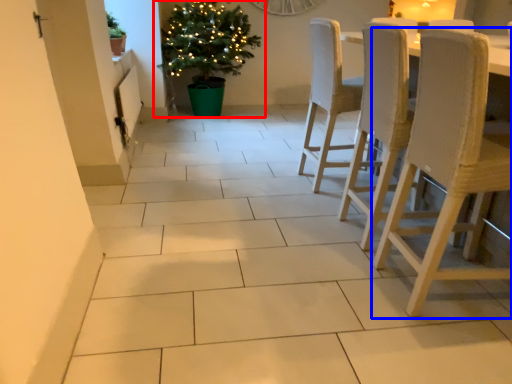
Question: Which point is closer to the camera, houseplant (highlighted by a red box) or chair (highlighted by a blue box)?

Choices:
 (A) houseplant
 (B) chair

Answer: (B)